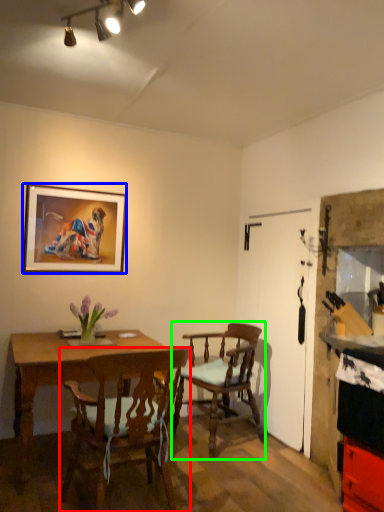
Question: Based on their relative distances, which object is nearer to chair (highlighted by a red box)? Choose from picture frame (highlighted by a blue box) and chair (highlighted by a green box).

Choices:
 (A) picture frame
 (B) chair

Answer: (B)